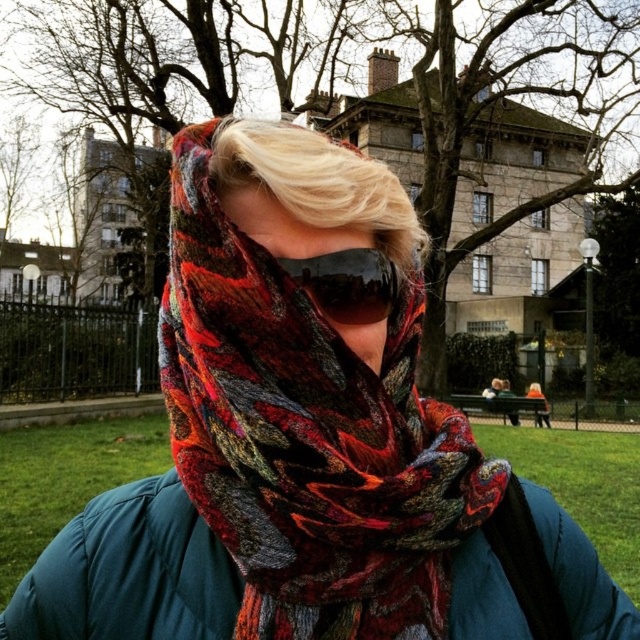
Question: Which point appears farthest from the camera in this image?

Choices:
 (A) (301, 280)
 (B) (86, 608)
 (C) (547, 403)
 (D) (268, 468)

Answer: (C)

Question: Among these points, which one is nearest to the camera?

Choices:
 (A) (536, 419)
 (B) (264, 548)

Answer: (B)

Question: Which point is closer to the camera taking this photo?

Choices:
 (A) (435, 595)
 (B) (525, 392)

Answer: (A)

Question: Considering the relative positions of glossy plastic goggles at center and orange knit hat at center in the image provided, where is glossy plastic goggles at center located with respect to orange knit hat at center?

Choices:
 (A) above
 (B) below

Answer: (A)

Question: In this image, where is multicolored knitted scarf at center located relative to teal quilted jacket at center?

Choices:
 (A) left
 (B) right

Answer: (B)

Question: Can you confirm if multicolored knitted scarf at center is positioned to the left of teal quilted jacket at center?

Choices:
 (A) yes
 (B) no

Answer: (B)